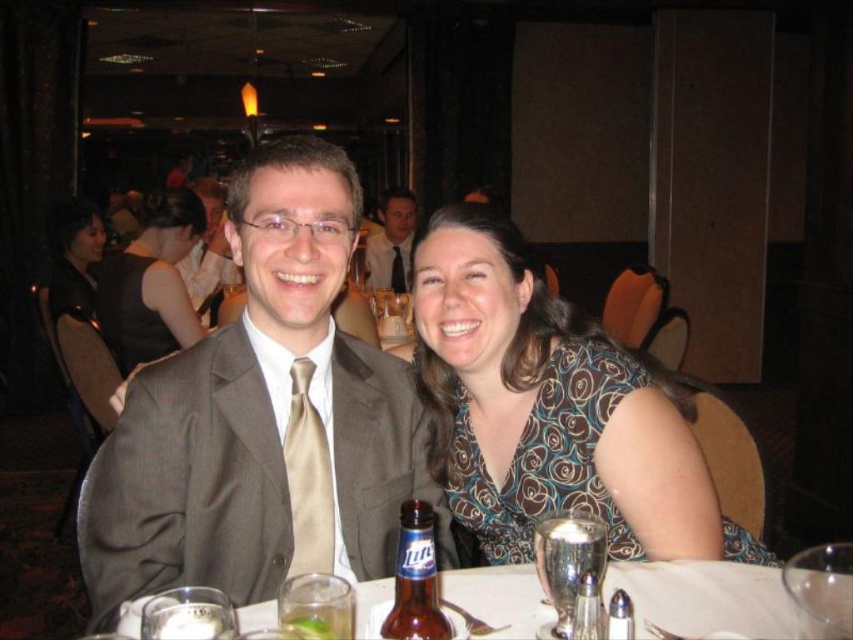
Question: Which of the following is the closest to the observer?

Choices:
 (A) matte black dress at center
 (B) matte gray suit at center
 (C) brown glass bottle at center
 (D) gold silk tie at center

Answer: (C)

Question: Among these points, which one is farthest from the camera?

Choices:
 (A) (641, 432)
 (B) (323, 548)
 (C) (585, 570)

Answer: (A)

Question: From the image, what is the correct spatial relationship of satin beige tie at center in relation to light brown suit at center?

Choices:
 (A) right
 (B) left

Answer: (A)

Question: Can you confirm if matte gray suit at center is positioned below light brown suit at center?

Choices:
 (A) no
 (B) yes

Answer: (B)

Question: Which point is closer to the camera?

Choices:
 (A) patterned fabric blouse at center
 (B) brown glass bottle at center
 (C) matte black dress at center

Answer: (B)

Question: From the image, what is the correct spatial relationship of clear glass at lower center in relation to brown glass beer bottle at center?

Choices:
 (A) left
 (B) right

Answer: (A)